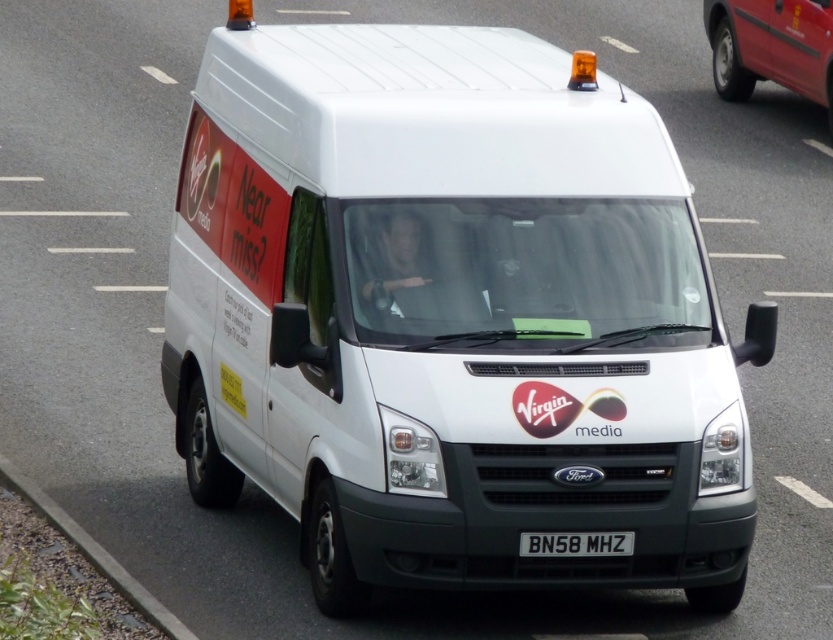
Question: Can you confirm if white matte van at center is positioned to the left of black plastic license plate at center?

Choices:
 (A) no
 (B) yes

Answer: (B)

Question: Which of these objects is positioned closest to the black plastic license plate at center?

Choices:
 (A) white matte van at center
 (B) metallic red van at upper right

Answer: (A)

Question: Does white matte van at center lie in front of black plastic license plate at center?

Choices:
 (A) no
 (B) yes

Answer: (B)

Question: Which point is closer to the camera?

Choices:
 (A) (559, 540)
 (B) (714, 572)

Answer: (A)

Question: Which point is farther from the camera taking this photo?

Choices:
 (A) (564, 556)
 (B) (736, 3)
 (C) (165, 380)

Answer: (B)

Question: Does white matte van at center appear on the left side of black plastic license plate at center?

Choices:
 (A) no
 (B) yes

Answer: (B)